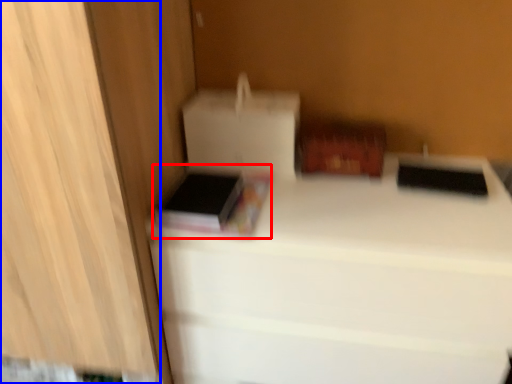
Question: Which object appears closest to the camera in this image, book (highlighted by a red box) or cabinetry (highlighted by a blue box)?

Choices:
 (A) book
 (B) cabinetry

Answer: (B)